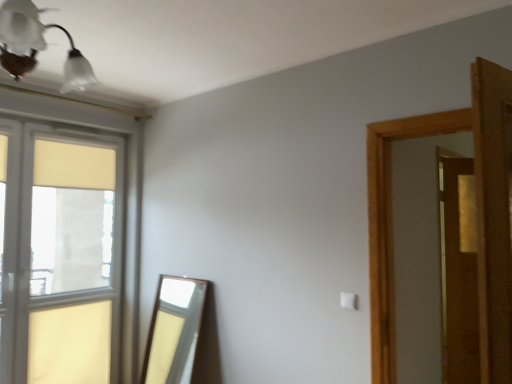
Describe the element at coordinates (81, 215) in the screenshot. I see `matte glass window at left` at that location.

The image size is (512, 384). Describe the element at coordinates (459, 271) in the screenshot. I see `wooden screen door at right` at that location.

Describe the element at coordinates (391, 225) in the screenshot. This screenshot has width=512, height=384. I see `wooden door at right` at that location.

I want to click on matte glass window at left, so click(x=81, y=215).

Identify the location of screen door that is below the matte glass window at left (from the image's perspective). (459, 271).

From a real-world perspective, who is located lower, matte glass window at left or wooden screen door at right?

In real-world perspective, wooden screen door at right is lower.

Is matte glass window at left to the right of wooden screen door at right from the viewer's perspective?

In fact, matte glass window at left is to the left of wooden screen door at right.

From their relative heights in the image, would you say white glass light fixture at upper left is taller or shorter than wooden door at right?

Clearly, white glass light fixture at upper left is shorter compared to wooden door at right.

Can you tell me how much white glass light fixture at upper left and wooden door at right differ in facing direction?

The angular difference between white glass light fixture at upper left and wooden door at right is 179 degrees.

Can you confirm if white glass light fixture at upper left is positioned to the right of wooden door at right?

In fact, white glass light fixture at upper left is to the left of wooden door at right.

Is white glass light fixture at upper left located within matte glass window at left?

That's incorrect, white glass light fixture at upper left is not inside matte glass window at left.

Does matte glass window at left have a greater height compared to white glass light fixture at upper left?

Correct, matte glass window at left is much taller as white glass light fixture at upper left.

From a real-world perspective, is matte glass window at left below white glass light fixture at upper left?

Yes, from a real-world perspective, matte glass window at left is under white glass light fixture at upper left.

Does matte glass window at left have a larger size compared to white glass light fixture at upper left?

Correct, matte glass window at left is larger in size than white glass light fixture at upper left.

From their relative heights in the image, would you say wooden door at right is taller or shorter than wooden screen door at right?

In the image, wooden door at right appears to be shorter than wooden screen door at right.

Locate an element on the screen. The width and height of the screenshot is (512, 384). window frame on the left of wooden screen door at right is located at coordinates (391, 225).

From a real-world perspective, which is physically below, wooden door at right or wooden screen door at right?

In real-world perspective, wooden screen door at right is lower.

Based on the photo, which object is further away from the camera, wooden door at right or wooden screen door at right?

wooden screen door at right is behind.

Considering the relative sizes of wooden door at right and white glass light fixture at upper left in the image provided, is wooden door at right bigger than white glass light fixture at upper left?

Incorrect, wooden door at right is not larger than white glass light fixture at upper left.

Is wooden door at right aimed at white glass light fixture at upper left?

Yes, wooden door at right is turned towards white glass light fixture at upper left.

Is wooden door at right shorter than white glass light fixture at upper left?

No.

Could you tell me if white glass light fixture at upper left is turned towards wooden screen door at right?

Yes, white glass light fixture at upper left is turned towards wooden screen door at right.

Which of these two, white glass light fixture at upper left or wooden screen door at right, stands shorter?

white glass light fixture at upper left.

From a real-world perspective, which is physically below, white glass light fixture at upper left or wooden screen door at right?

From a 3D spatial view, wooden screen door at right is below.

Between point (73, 62) and point (472, 174), which one is positioned behind?

The point (472, 174) is farther.

Looking at this image, does wooden screen door at right appear on the left side of matte glass window at left?

In fact, wooden screen door at right is to the right of matte glass window at left.

From a real-world perspective, which object stands above the other?

matte glass window at left.

Who is bigger, wooden screen door at right or matte glass window at left?

matte glass window at left.

Which is more distant, (447, 190) or (80, 299)?

Positioned behind is point (80, 299).

The width and height of the screenshot is (512, 384). I want to click on window in front of the wooden screen door at right, so click(x=81, y=215).

This screenshot has width=512, height=384. What are the coordinates of `light fixture above the wooden door at right (from the image's perspective)` in the screenshot? It's located at (36, 46).

When comparing their distances from wooden screen door at right, does matte glass window at left or white glass light fixture at upper left seem further?

white glass light fixture at upper left is positioned further to the anchor wooden screen door at right.

Which object lies further to the anchor point wooden door at right, wooden screen door at right or matte glass window at left?

matte glass window at left is positioned further to the anchor wooden door at right.

When comparing their distances from matte glass window at left, does wooden door at right or white glass light fixture at upper left seem closer?

Among the two, white glass light fixture at upper left is located nearer to matte glass window at left.

Estimate the real-world distances between objects in this image. Which object is closer to wooden door at right, matte glass window at left or wooden screen door at right?

Based on the image, wooden screen door at right appears to be nearer to wooden door at right.

Looking at the image, which one is located further to wooden door at right, matte glass window at left or white glass light fixture at upper left?

matte glass window at left.

Estimate the real-world distances between objects in this image. Which object is further from white glass light fixture at upper left, matte glass window at left or wooden screen door at right?

wooden screen door at right.

Looking at the image, which one is located further to matte glass window at left, wooden screen door at right or white glass light fixture at upper left?

wooden screen door at right lies further to matte glass window at left than the other object.

Which object lies nearer to the anchor point matte glass window at left, white glass light fixture at upper left or wooden door at right?

The object closer to matte glass window at left is white glass light fixture at upper left.

The image size is (512, 384). I want to click on light fixture located between matte glass window at left and wooden door at right in the left-right direction, so click(36, 46).

Locate an element on the screen. This screenshot has width=512, height=384. window frame located between white glass light fixture at upper left and wooden screen door at right in the left-right direction is located at coordinates (391, 225).

You are a GUI agent. You are given a task and a screenshot of the screen. Output one action in this format:
    pyautogui.click(x=<x>, y=<y>)
    Task: Click on the light fixture between matte glass window at left and wooden screen door at right from left to right
    The height and width of the screenshot is (384, 512).
    Given the screenshot: What is the action you would take?
    pyautogui.click(x=36, y=46)

At what (x,y) coordinates should I click in order to perform the action: click on window frame located between matte glass window at left and wooden screen door at right in the left-right direction. Please return your answer as a coordinate pair (x, y). This screenshot has width=512, height=384. Looking at the image, I should click on (391, 225).